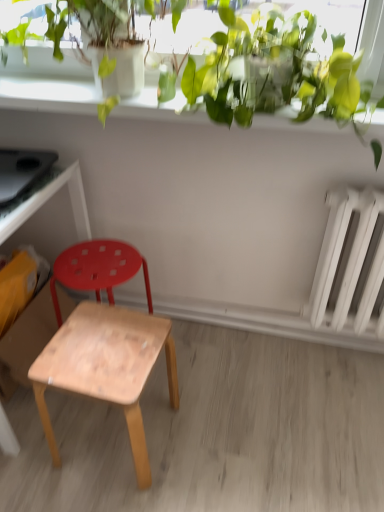
Question: Can you confirm if green leafy plant at upper center is taller than white matte radiator at right?

Choices:
 (A) no
 (B) yes

Answer: (A)

Question: Can you confirm if green leafy plant at upper center is smaller than white matte radiator at right?

Choices:
 (A) no
 (B) yes

Answer: (A)

Question: From a real-world perspective, is green leafy plant at upper center beneath white matte radiator at right?

Choices:
 (A) yes
 (B) no

Answer: (B)

Question: Is white matte radiator at right located within green leafy plant at upper center?

Choices:
 (A) yes
 (B) no

Answer: (B)

Question: Is green leafy plant at upper center closer to the viewer compared to white matte radiator at right?

Choices:
 (A) yes
 (B) no

Answer: (A)

Question: Considering the relative sizes of green leafy plant at upper center and white matte radiator at right in the image provided, is green leafy plant at upper center wider than white matte radiator at right?

Choices:
 (A) yes
 (B) no

Answer: (A)

Question: Is white matte radiator at right positioned far away from wooden stool at lower left, marked as the 1th stool in a back-to-front arrangement?

Choices:
 (A) no
 (B) yes

Answer: (A)

Question: Does white matte radiator at right have a smaller size compared to wooden stool at lower left, the 2th stool viewed from the front?

Choices:
 (A) yes
 (B) no

Answer: (B)

Question: Does white matte radiator at right come behind wooden stool at lower left, marked as the 1th stool in a back-to-front arrangement?

Choices:
 (A) yes
 (B) no

Answer: (B)

Question: Is white matte radiator at right outside of wooden stool at lower left, marked as the 1th stool in a back-to-front arrangement?

Choices:
 (A) no
 (B) yes

Answer: (B)

Question: Is white matte radiator at right bigger than wooden stool at lower left, the 2th stool viewed from the front?

Choices:
 (A) no
 (B) yes

Answer: (B)

Question: Is white matte radiator at right shorter than wooden stool at lower left, the 2th stool viewed from the front?

Choices:
 (A) no
 (B) yes

Answer: (A)

Question: Considering the relative sizes of green leafy plant at upper center and natural wood stool at center, which is the first stool in front-to-back order, in the image provided, is green leafy plant at upper center shorter than natural wood stool at center, which is the first stool in front-to-back order,?

Choices:
 (A) yes
 (B) no

Answer: (A)